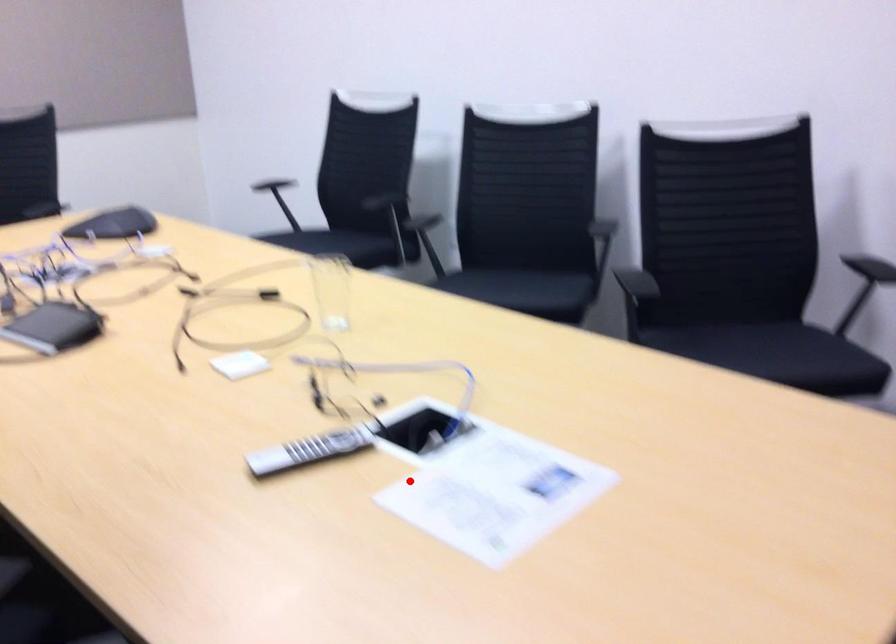
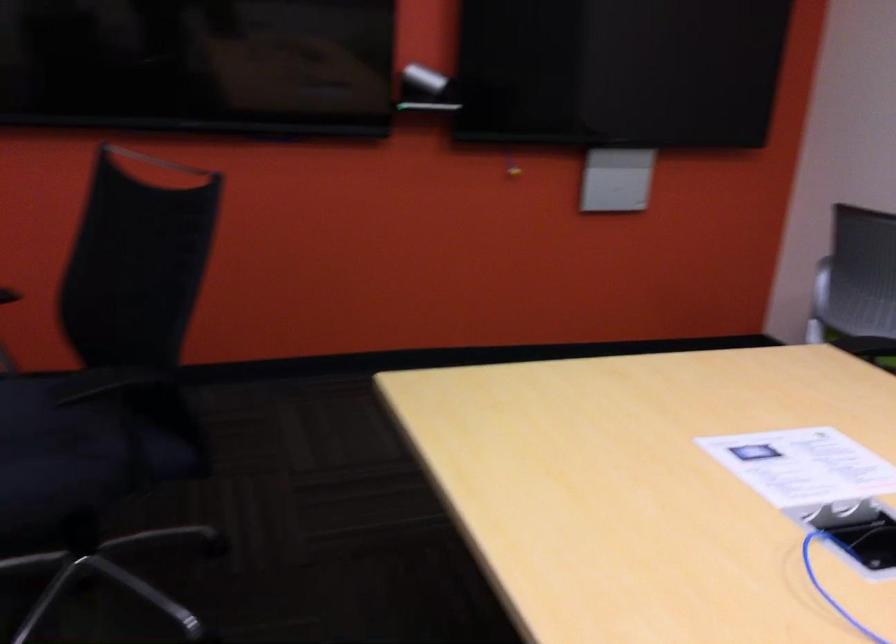
Where in the second image is the point corresponding to the highlighted location from the first image?

(858, 532)